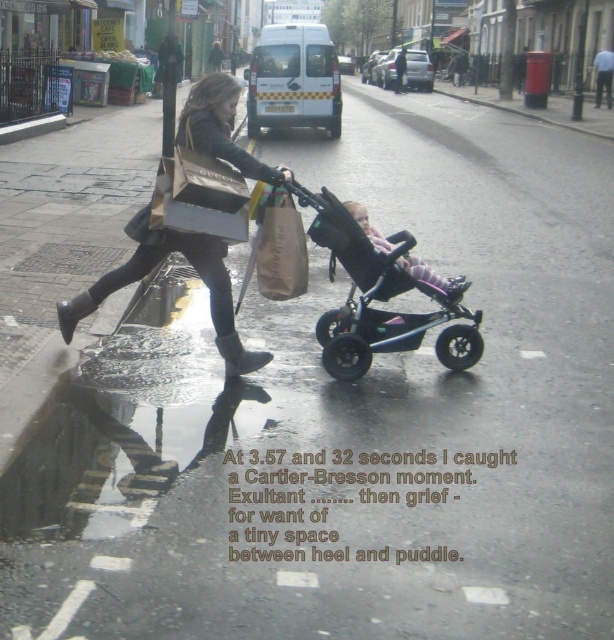
You are a delivery person trying to navigate through the street scene. There is a pink fabric stroller at center and a black rubber rain boot at lower left. Which object is closer to you as you approach the scene?

The pink fabric stroller at center is closer to you because it is in front of the black rubber rain boot at lower left.

You are standing at point (456, 288) and want to move to point (456, 369). Is the path between these two points clear of any obstacles?

The path between point (456, 288) and point (456, 369) is clear of any obstacles.

You are a pedestrian trying to cross the street while avoiding puddles. You see the pink fabric stroller at center and the black rubber rain boot at lower left. Which object is higher up in the image?

The pink fabric stroller at center is above the black rubber rain boot at lower left, so the pink fabric stroller at center is higher up in the image.